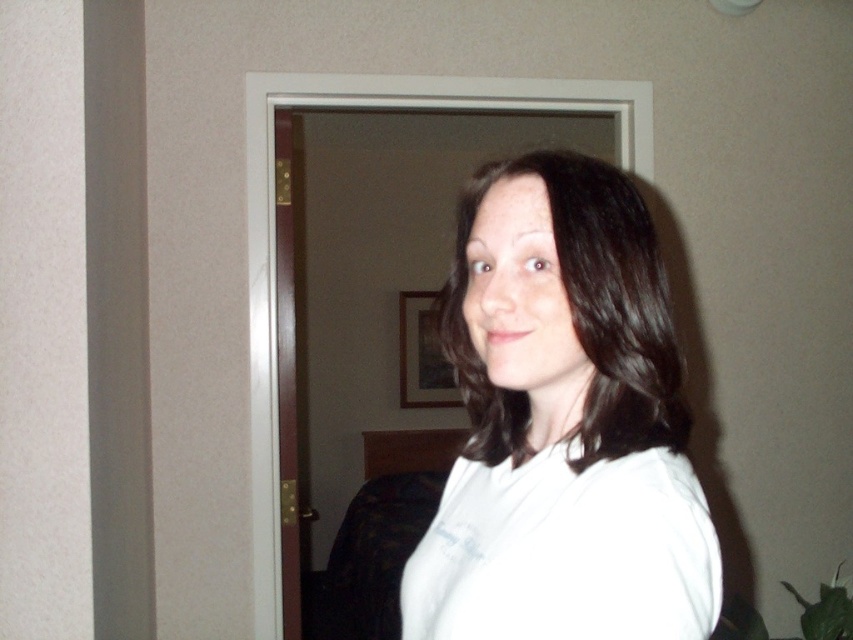
Question: Is white matte shirt at center smaller than white cotton shirt at center?

Choices:
 (A) yes
 (B) no

Answer: (B)

Question: Observing the image, what is the correct spatial positioning of white matte shirt at center in reference to white cotton shirt at center?

Choices:
 (A) below
 (B) above

Answer: (B)

Question: Can you confirm if white matte shirt at center is positioned below white cotton shirt at center?

Choices:
 (A) yes
 (B) no

Answer: (B)

Question: Which point appears farthest from the camera in this image?

Choices:
 (A) (479, 536)
 (B) (695, 508)

Answer: (A)